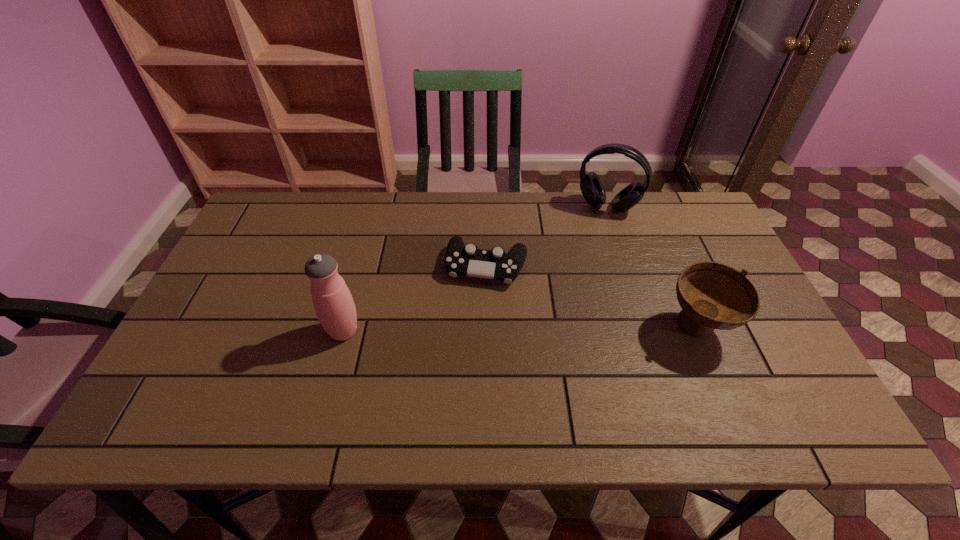
This screenshot has width=960, height=540. What are the coordinates of `the leftmost object` in the screenshot? It's located at (334, 306).

Locate an element on the screen. Image resolution: width=960 pixels, height=540 pixels. soup bowl is located at coordinates (712, 295).

You are a GUI agent. You are given a task and a screenshot of the screen. Output one action in this format:
    pyautogui.click(x=<x>, y=<y>)
    Task: Click on the farthest object
    Image resolution: width=960 pixels, height=540 pixels.
    Given the screenshot: What is the action you would take?
    point(591,186)

The image size is (960, 540). I want to click on headset, so click(591, 186).

At what (x,y) coordinates should I click in order to perform the action: click on the shortest object. Please return your answer as a coordinate pair (x, y). This screenshot has height=540, width=960. Looking at the image, I should click on (468, 260).

Find the location of a particular element. The image size is (960, 540). the second farthest object is located at coordinates (468, 260).

I want to click on vacant space situated 0.240m on the left of the leftmost object, so click(228, 331).

Identify the location of vacant space located 0.350m on the left of the second shortest object. This screenshot has width=960, height=540. (521, 328).

Find the location of a particular element. The width and height of the screenshot is (960, 540). vacant space located 0.060m on the earcups of the farthest object is located at coordinates (594, 230).

Find the location of a particular element. The height and width of the screenshot is (540, 960). free space located 0.360m on the earcups of the farthest object is located at coordinates (569, 298).